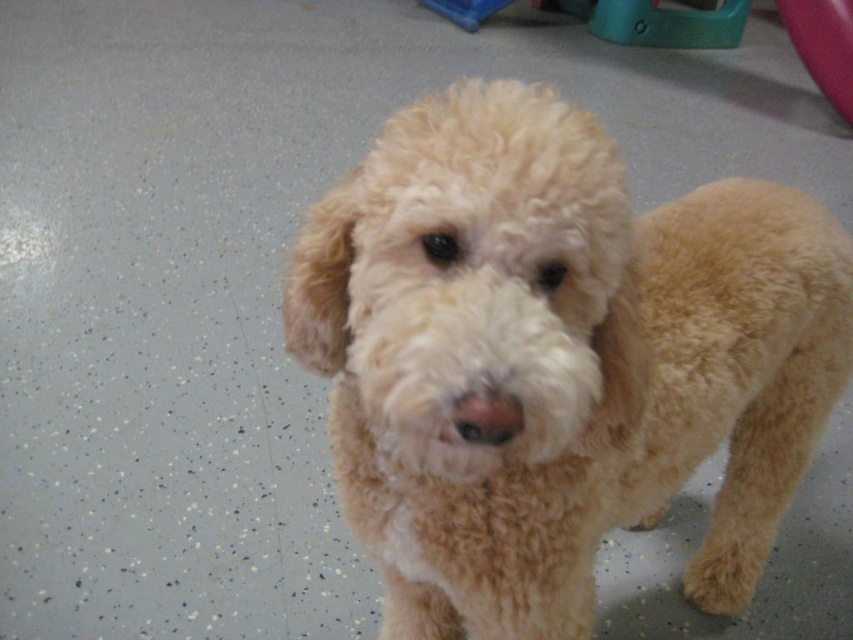
Looking at this image, you are a small dog with curly light beige fur. You see the teal plastic toy at upper right and the rubber at upper right. Which object is wider?

The teal plastic toy at upper right is wider than the rubber at upper right because its width surpasses the rubber at upper right.

You are a delivery robot standing 22 inches away from the fuzzy beige dog at center. Can you safely extend your robotic arm to pet the dog without getting too close?

The fuzzy beige dog at center and viewer are 22.51 inches apart. Since the robot is standing 22 inches away, it is close enough to safely extend its robotic arm to pet the dog without needing to move closer.

You are a pet owner who wants to place a treat bowl between the fuzzy beige dog at center and the blue plastic toy at upper center. Based on their positions, where should you place the bowl so it is equidistant from both?

The fuzzy beige dog at center is in front of the blue plastic toy at upper center, so placing the treat bowl between them but closer to the blue plastic toy at upper center will make it equidistant from both.